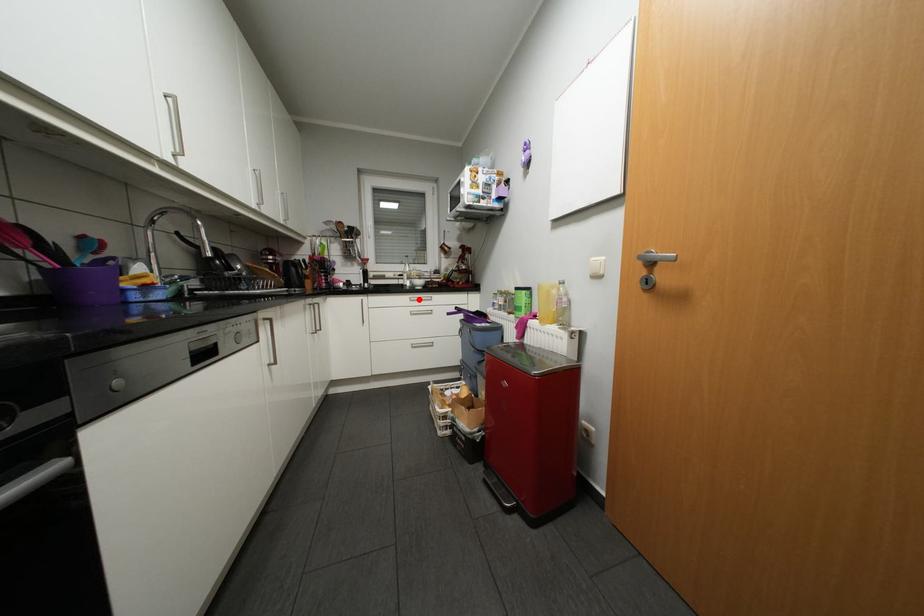
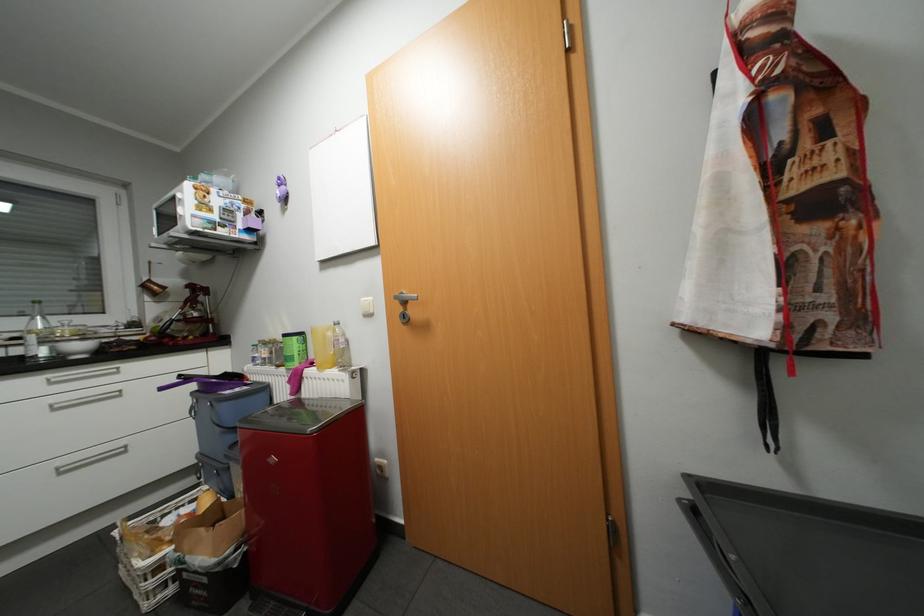
Where in the second image is the point corresponding to the highlighted location from the first image?

(61, 382)